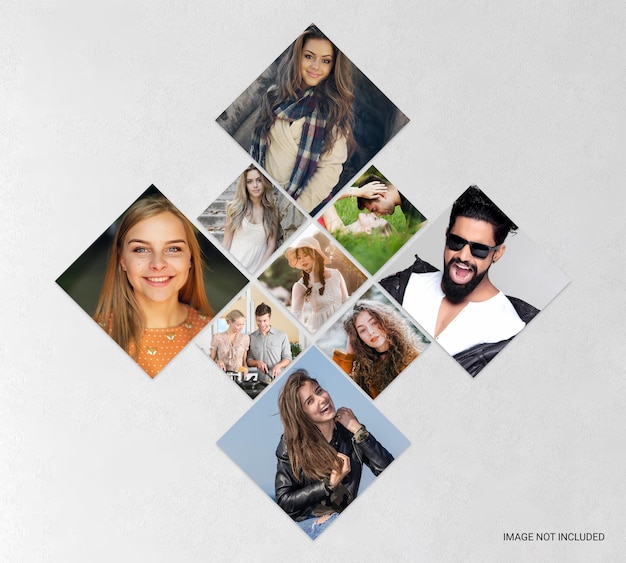
Image resolution: width=626 pixels, height=563 pixels. Identify the location of collage pictures. (310, 126), (367, 201), (258, 208), (314, 276), (485, 288), (364, 330), (329, 437), (268, 358), (149, 282).